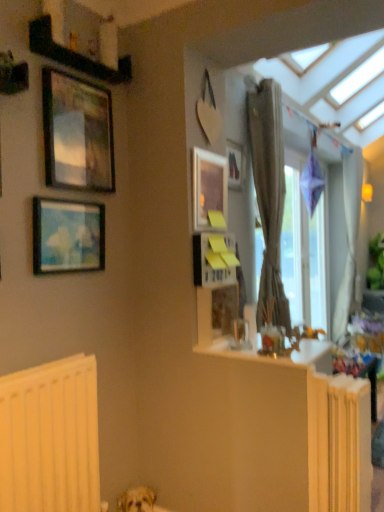
Question: Does yellow painted radiator at lower right, which is the first radiator from right to left, have a greater height compared to metallic gold picture frame at upper left, which ranks as the 3th picture frame in right-to-left order?

Choices:
 (A) yes
 (B) no

Answer: (A)

Question: Is the depth of yellow painted radiator at lower right, the second radiator from the left, greater than that of metallic gold picture frame at upper left, arranged as the 2th picture frame when viewed from the front?

Choices:
 (A) no
 (B) yes

Answer: (A)

Question: Can you confirm if yellow painted radiator at lower right, which is the first radiator from right to left, is wider than metallic gold picture frame at upper left, which ranks as the 3th picture frame in right-to-left order?

Choices:
 (A) no
 (B) yes

Answer: (B)

Question: Does yellow painted radiator at lower right, the second radiator from the left, have a larger size compared to metallic gold picture frame at upper left, the 2th picture frame from the left?

Choices:
 (A) yes
 (B) no

Answer: (A)

Question: Is the surface of yellow painted radiator at lower right, which is the first radiator from right to left, in direct contact with metallic gold picture frame at upper left, the 2th picture frame from the left?

Choices:
 (A) yes
 (B) no

Answer: (B)

Question: Considering the positions of point (238, 160) and point (92, 371), is point (238, 160) closer or farther from the camera than point (92, 371)?

Choices:
 (A) closer
 (B) farther

Answer: (B)

Question: Is wooden picture frame at upper center, which is the first picture frame from right to left, taller or shorter than white matte radiator at lower left, the 1th radiator in the left-to-right sequence?

Choices:
 (A) short
 (B) tall

Answer: (A)

Question: Looking at their shapes, would you say wooden picture frame at upper center, which is the first picture frame from right to left, is wider or thinner than white matte radiator at lower left, the 1th radiator in the left-to-right sequence?

Choices:
 (A) thin
 (B) wide

Answer: (A)

Question: From the image's perspective, is wooden picture frame at upper center, acting as the 4th picture frame starting from the front, above or below white matte radiator at lower left, the 1th radiator in the left-to-right sequence?

Choices:
 (A) below
 (B) above

Answer: (B)

Question: Considering the positions of point (127, 507) and point (288, 268), is point (127, 507) closer or farther from the camera than point (288, 268)?

Choices:
 (A) closer
 (B) farther

Answer: (A)

Question: From the image's perspective, is light brown fur at lower center located above or below transparent glass window at right?

Choices:
 (A) below
 (B) above

Answer: (A)

Question: Visually, is light brown fur at lower center positioned to the left or to the right of transparent glass window at right?

Choices:
 (A) right
 (B) left

Answer: (B)

Question: Is light brown fur at lower center situated inside transparent glass window at right or outside?

Choices:
 (A) inside
 (B) outside

Answer: (B)

Question: From a real-world perspective, relative to wooden picture frame at upper center, acting as the 4th picture frame starting from the front, is light brown fur at lower center vertically above or below?

Choices:
 (A) below
 (B) above

Answer: (A)

Question: From the image's perspective, is light brown fur at lower center positioned above or below wooden picture frame at upper center, the 1th picture frame positioned from the back?

Choices:
 (A) above
 (B) below

Answer: (B)